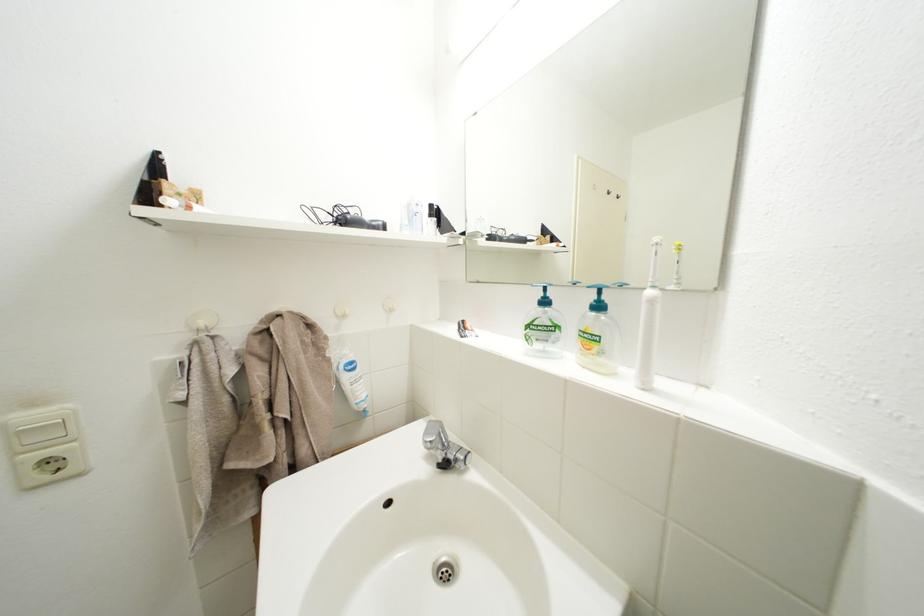
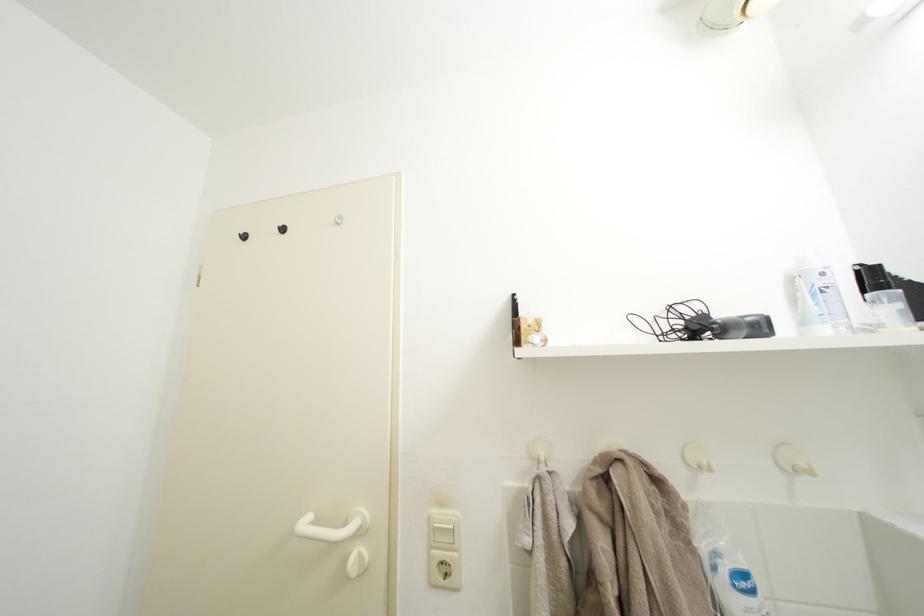
Find the pixel in the second image that matches point (427, 209) in the first image.

(833, 280)